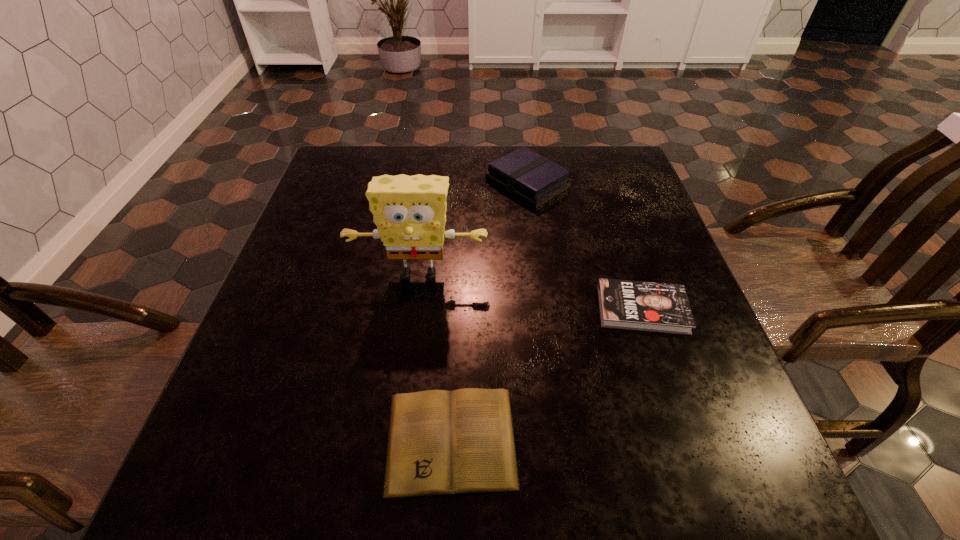
The image size is (960, 540). In order to click on the tallest object in this screenshot , I will do `click(409, 211)`.

At what (x,y) coordinates should I click in order to perform the action: click on the farthest book. Please return your answer as a coordinate pair (x, y). Looking at the image, I should click on click(534, 179).

Find the location of a particular element. This screenshot has height=540, width=960. the third shortest object is located at coordinates coord(534,179).

At what (x,y) coordinates should I click in order to perform the action: click on the third tallest object. Please return your answer as a coordinate pair (x, y). The image size is (960, 540). Looking at the image, I should click on (633, 305).

Where is `the second shortest book`? The height and width of the screenshot is (540, 960). the second shortest book is located at coordinates (633, 305).

Locate an element on the screen. This screenshot has height=540, width=960. the nearest book is located at coordinates (440, 442).

Locate an element on the screen. This screenshot has height=540, width=960. the shortest object is located at coordinates (440, 442).

The height and width of the screenshot is (540, 960). Identify the location of vacant area situated 0.260m on the face of the tallest object. (400, 410).

Locate an element on the screen. Image resolution: width=960 pixels, height=540 pixels. vacant point located on the right of the tallest book is located at coordinates (615, 184).

In order to click on free spot located 0.390m on the back of the second farthest book in this screenshot , I will do `click(599, 180)`.